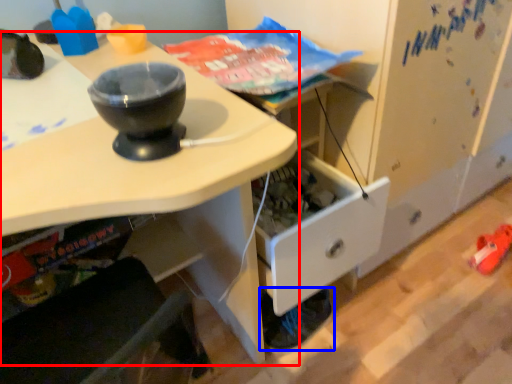
Question: Among these objects, which one is farthest to the camera, desk (highlighted by a red box) or footwear (highlighted by a blue box)?

Choices:
 (A) desk
 (B) footwear

Answer: (B)